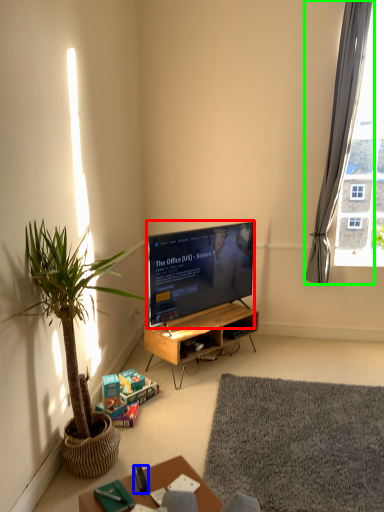
Question: Which object is the farthest from television (highlighted by a red box)? Choose among these: remote control (highlighted by a blue box) or curtain (highlighted by a green box).

Choices:
 (A) remote control
 (B) curtain

Answer: (A)